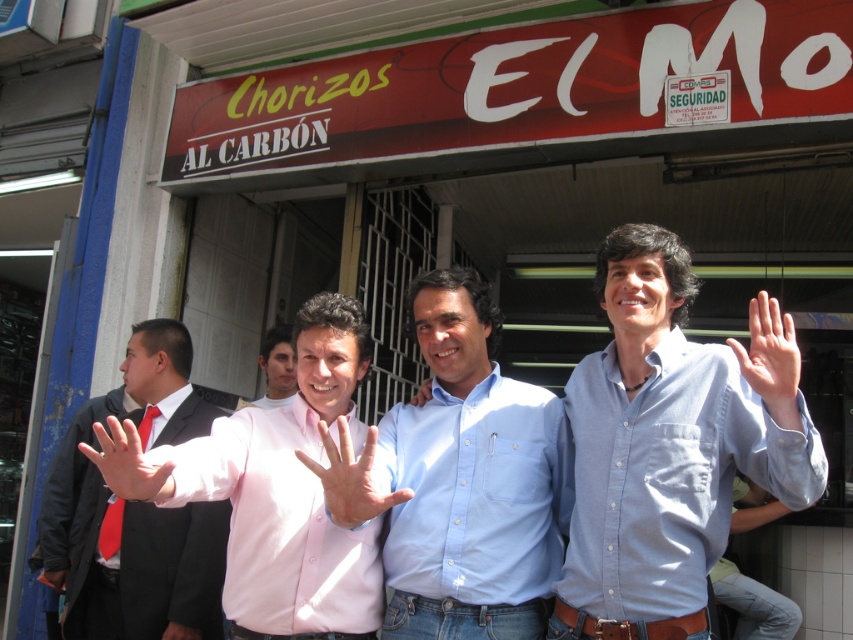
Measure the distance from light blue button-down shirt at center to smooth skin hand at center.

light blue button-down shirt at center is 73.88 centimeters from smooth skin hand at center.

Can you confirm if light blue button-down shirt at center is positioned to the right of smooth skin hand at center?

Correct, you'll find light blue button-down shirt at center to the right of smooth skin hand at center.

Does point (527, 506) lie in front of point (117, 481)?

No, it is behind (117, 481).

Where is `light blue button-down shirt at center`? light blue button-down shirt at center is located at coordinates (461, 481).

Does point (193, 621) come farther from viewer compared to point (103, 460)?

Yes.

Does pink shirt at left appear under smooth skin hand at center?

Correct, pink shirt at left is located below smooth skin hand at center.

The image size is (853, 640). What do you see at coordinates (142, 566) in the screenshot?
I see `pink shirt at left` at bounding box center [142, 566].

This screenshot has height=640, width=853. Find the location of `pink shirt at left`. pink shirt at left is located at coordinates click(x=142, y=566).

Can you confirm if pink smooth skin at center is wider than pink fabric hand at center?

Correct, the width of pink smooth skin at center exceeds that of pink fabric hand at center.

Is pink smooth skin at center to the left of pink fabric hand at center from the viewer's perspective?

Correct, you'll find pink smooth skin at center to the left of pink fabric hand at center.

Does point (349, 518) lie behind point (421, 385)?

That is False.

Image resolution: width=853 pixels, height=640 pixels. I want to click on pink smooth skin at center, so click(350, 477).